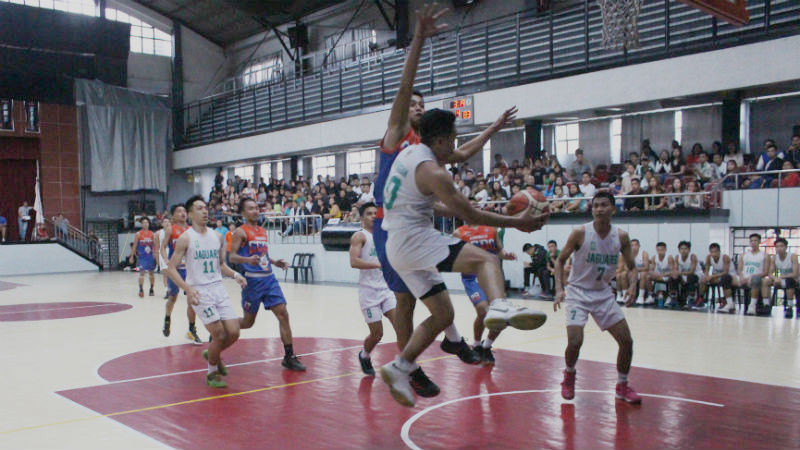
This screenshot has height=450, width=800. Find the location of `light colored flooring`. light colored flooring is located at coordinates (44, 340), (318, 306), (718, 347).